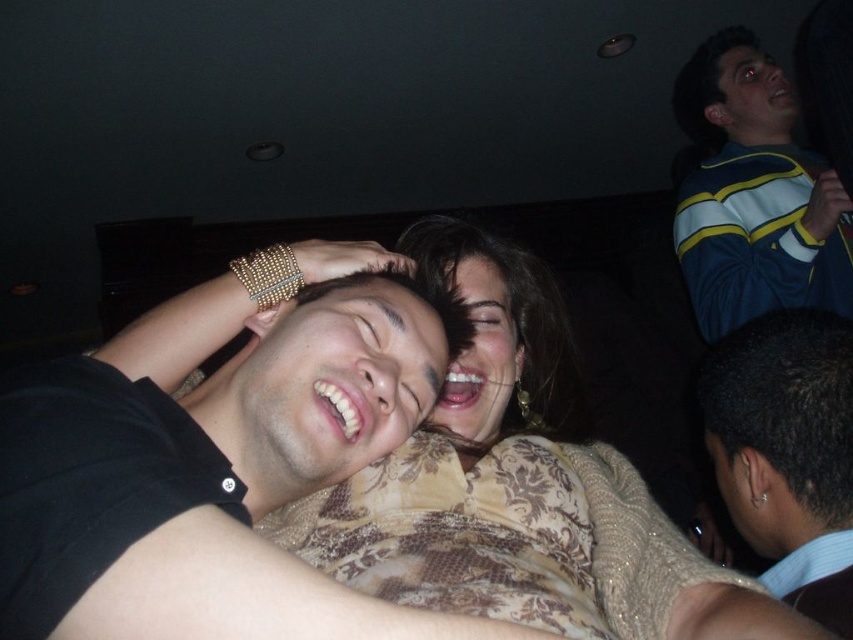
You are standing at the entrance of the room and see two points in the image. The first point is at coordinate point (x=444, y=484) and the second point is at coordinate point (x=689, y=120). Which point is closer to you?

Point (x=444, y=484) is in front of point (x=689, y=120), so it is closer to you.

You are organizing a charity event and need to display two items from the image on a table. The black shirt at center and the gold textured sweater at center must be placed side by side. Since space is limited, you want to ensure that the smaller item is placed first to optimize space. Which item should you place first on the table?

The black shirt at center has a smaller size compared to the gold textured sweater at center, so you should place the black shirt at center first to optimize space.